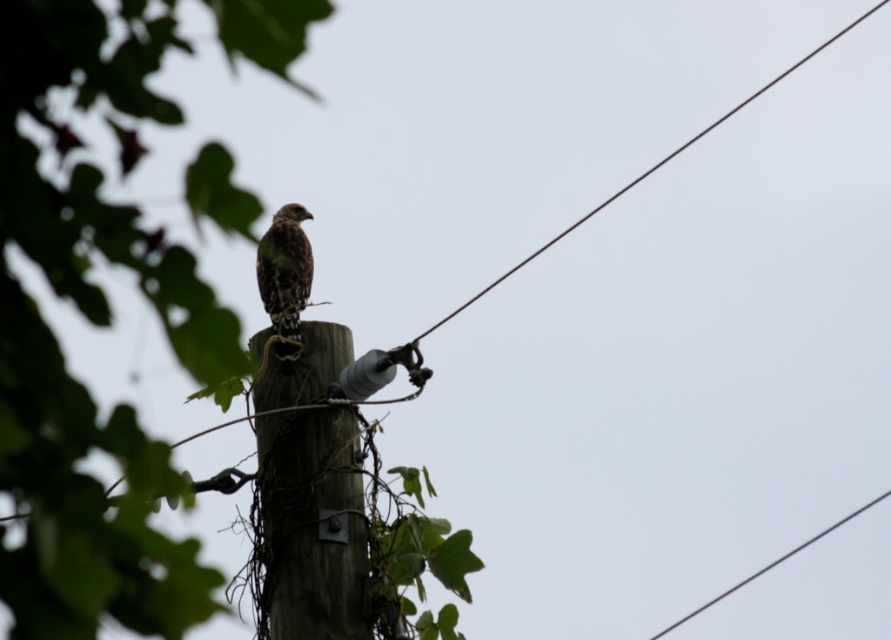
Question: Does brown wood post at center appear on the right side of brown wire at upper right?

Choices:
 (A) yes
 (B) no

Answer: (B)

Question: Which is farther from the brown speckled falcon at center?

Choices:
 (A) brown wood post at center
 (B) green leafy tree at center

Answer: (B)

Question: Can you confirm if green leafy tree at center is wider than brown speckled falcon at center?

Choices:
 (A) no
 (B) yes

Answer: (B)

Question: Which object is closer to the camera taking this photo?

Choices:
 (A) brown wire at upper right
 (B) brown wood post at center

Answer: (B)

Question: Which is nearer to the green leafy tree at center?

Choices:
 (A) brown wood post at center
 (B) brown speckled falcon at center
 (C) brown wire at upper right

Answer: (A)

Question: Does brown speckled falcon at center lie in front of brown wire at upper right?

Choices:
 (A) no
 (B) yes

Answer: (B)